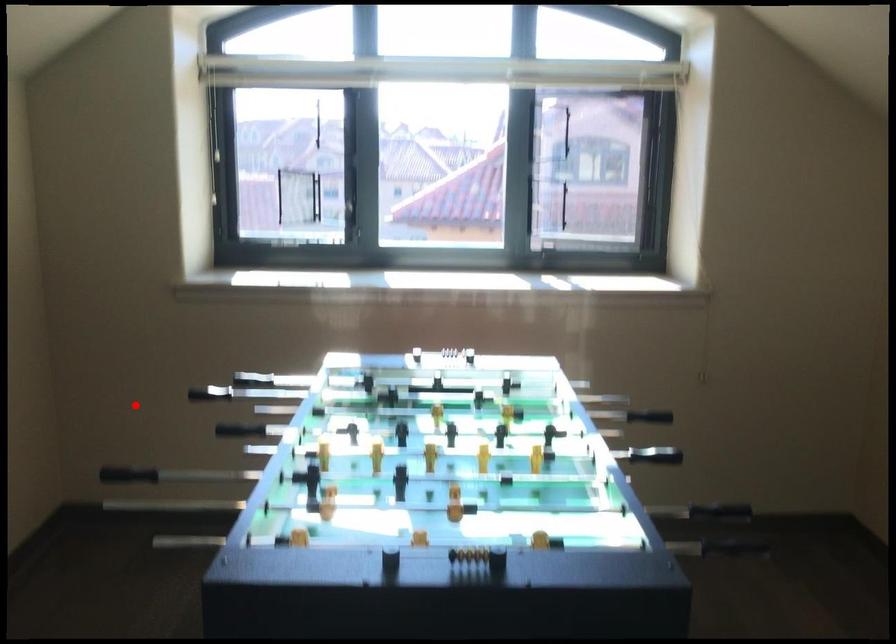
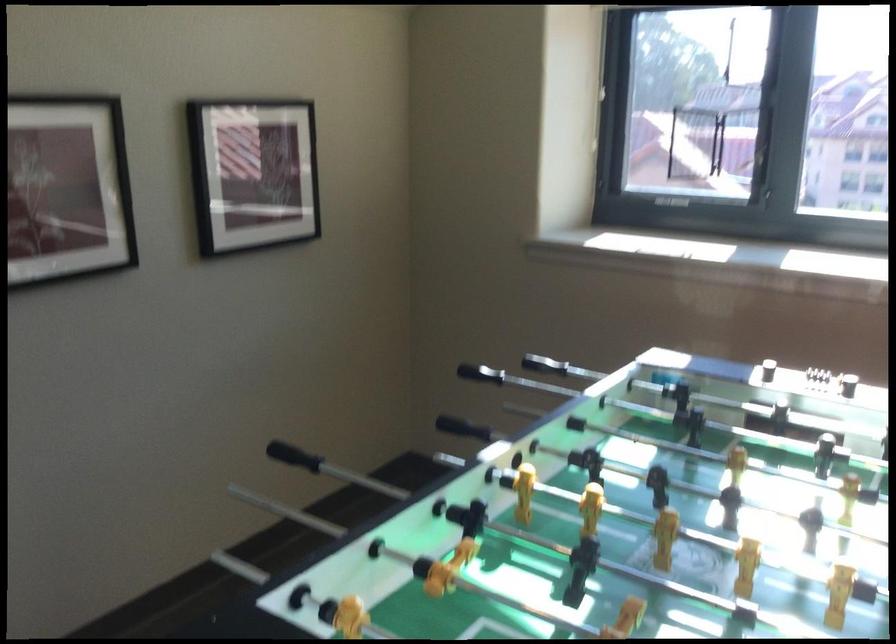
Question: I am providing you with two images of the same scene from different viewpoints. A red point is marked on the first image. Can you still see the location of the red point in image 2?

Choices:
 (A) Yes
 (B) No

Answer: (A)